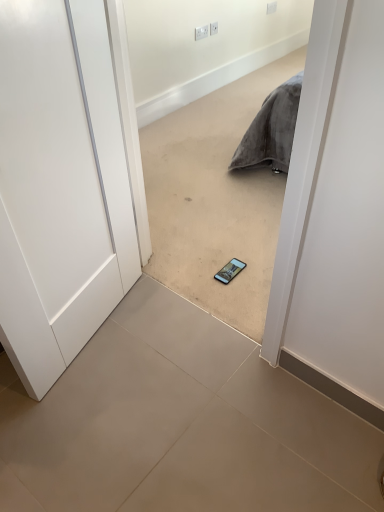
Question: Should I look upward or downward to see white plastic electric outlet at upper center, the second electric outlet in the right-to-left sequence?

Choices:
 (A) down
 (B) up

Answer: (B)

Question: Would you consider white plastic electric outlet at upper center, arranged as the first electric outlet when viewed from the right, to be distant from white plastic electric outlet at upper center, the second electric outlet in the right-to-left sequence?

Choices:
 (A) no
 (B) yes

Answer: (A)

Question: Is white plastic electric outlet at upper center, which is the second electric outlet from left to right, oriented away from white plastic electric outlet at upper center, the second electric outlet in the right-to-left sequence?

Choices:
 (A) no
 (B) yes

Answer: (A)

Question: Does white plastic electric outlet at upper center, which is the second electric outlet from left to right, have a smaller size compared to white plastic electric outlet at upper center, the second electric outlet in the right-to-left sequence?

Choices:
 (A) yes
 (B) no

Answer: (A)

Question: Considering the relative sizes of white plastic electric outlet at upper center, arranged as the first electric outlet when viewed from the right, and white plastic electric outlet at upper center, the second electric outlet in the right-to-left sequence, in the image provided, is white plastic electric outlet at upper center, arranged as the first electric outlet when viewed from the right, shorter than white plastic electric outlet at upper center, the second electric outlet in the right-to-left sequence,?

Choices:
 (A) yes
 (B) no

Answer: (A)

Question: Can you confirm if white plastic electric outlet at upper center, arranged as the first electric outlet when viewed from the right, is taller than white plastic electric outlet at upper center, the second electric outlet in the right-to-left sequence?

Choices:
 (A) yes
 (B) no

Answer: (B)

Question: Is white plastic electric outlet at upper center, which is the second electric outlet from left to right, placed right next to white plastic electric outlet at upper center, which appears as the first electric outlet when viewed from the left?

Choices:
 (A) no
 (B) yes

Answer: (B)

Question: Can you confirm if white matte door at left is positioned to the left of white plastic electric outlet at upper center, which is the second electric outlet from left to right?

Choices:
 (A) no
 (B) yes

Answer: (B)

Question: Does white matte door at left have a greater width compared to white plastic electric outlet at upper center, arranged as the first electric outlet when viewed from the right?

Choices:
 (A) yes
 (B) no

Answer: (A)

Question: Is white matte door at left taller than white plastic electric outlet at upper center, arranged as the first electric outlet when viewed from the right?

Choices:
 (A) no
 (B) yes

Answer: (B)

Question: Is white matte door at left facing away from white plastic electric outlet at upper center, arranged as the first electric outlet when viewed from the right?

Choices:
 (A) no
 (B) yes

Answer: (A)

Question: Could you tell me if white matte door at left is facing white plastic electric outlet at upper center, arranged as the first electric outlet when viewed from the right?

Choices:
 (A) yes
 (B) no

Answer: (B)

Question: From the image's perspective, does white matte door at left appear higher than white plastic electric outlet at upper center, arranged as the first electric outlet when viewed from the right?

Choices:
 (A) yes
 (B) no

Answer: (B)

Question: Can you confirm if white plastic electric outlet at upper center, which is the second electric outlet from left to right, is positioned to the right of white matte door at left?

Choices:
 (A) no
 (B) yes

Answer: (B)